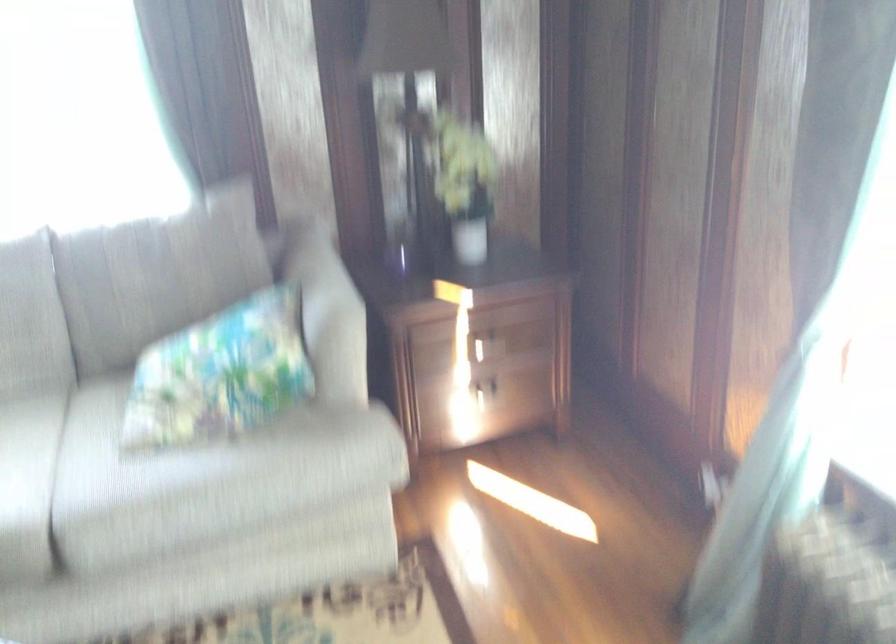
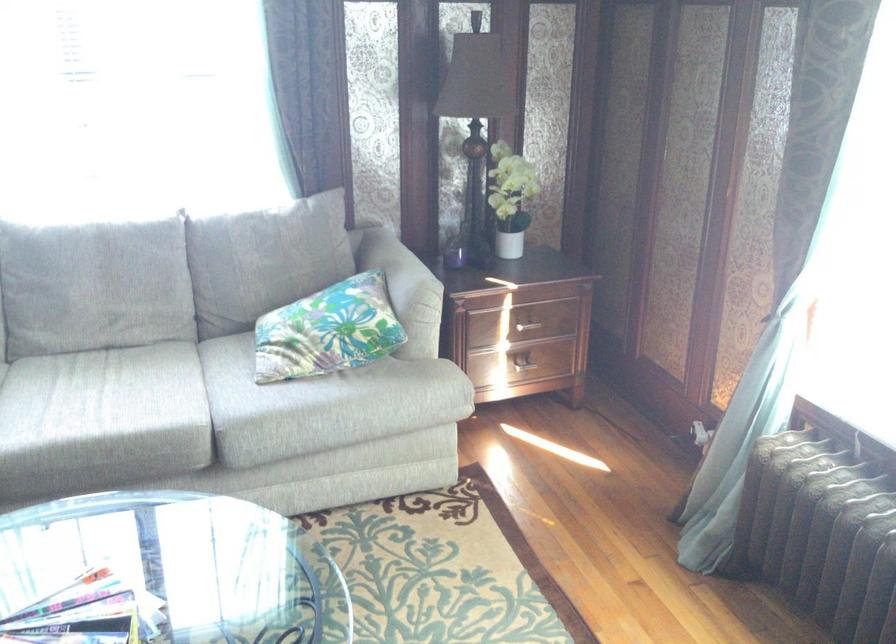
In the second image, find the point that corresponds to point (489, 351) in the first image.

(526, 327)